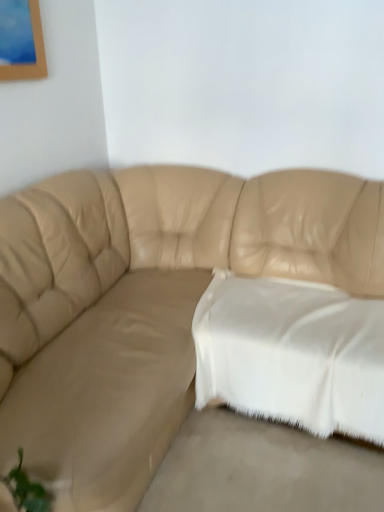
Question: From the image's perspective, is beige leather couch at lower left positioned above or below white soft fabric pillow at center?

Choices:
 (A) above
 (B) below

Answer: (B)

Question: From a real-world perspective, is beige leather couch at lower left above or below white soft fabric pillow at center?

Choices:
 (A) above
 (B) below

Answer: (B)

Question: Based on their relative distances, which object is farther from the beige leather couch at center?

Choices:
 (A) beige leather couch at lower left
 (B) white soft fabric pillow at center

Answer: (A)

Question: Which of these objects is positioned closest to the white soft fabric pillow at center?

Choices:
 (A) beige leather couch at lower left
 (B) beige leather couch at center

Answer: (A)